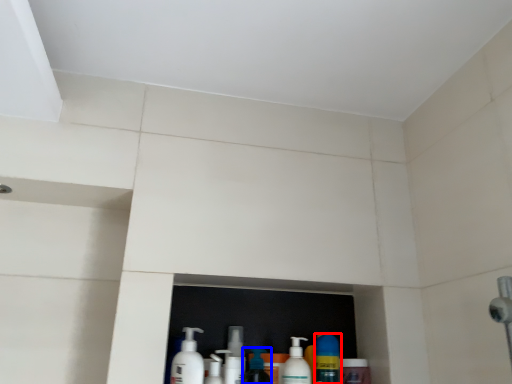
Question: Among these objects, which one is farthest to the camera, cleaning product (highlighted by a red box) or cleaning product (highlighted by a blue box)?

Choices:
 (A) cleaning product
 (B) cleaning product

Answer: (A)